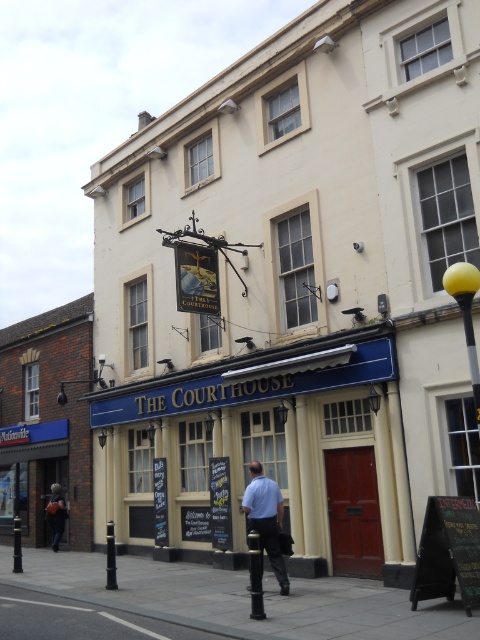
Question: Can you confirm if blue painted wooden pub at center is smaller than gray concrete pavement at lower center?

Choices:
 (A) no
 (B) yes

Answer: (A)

Question: Which of these objects is positioned farthest from the gray concrete pavement at lower center?

Choices:
 (A) blue shirt at center
 (B) blue painted wooden pub at center

Answer: (A)

Question: Which point is closer to the camera?

Choices:
 (A) (131, 616)
 (B) (248, 525)

Answer: (A)

Question: Among these points, which one is nearest to the camera?

Choices:
 (A) (133, 451)
 (B) (251, 508)

Answer: (B)

Question: Is blue painted wooden pub at center above blue shirt at center?

Choices:
 (A) no
 (B) yes

Answer: (B)

Question: Does blue painted wooden pub at center come in front of blue shirt at center?

Choices:
 (A) yes
 (B) no

Answer: (B)